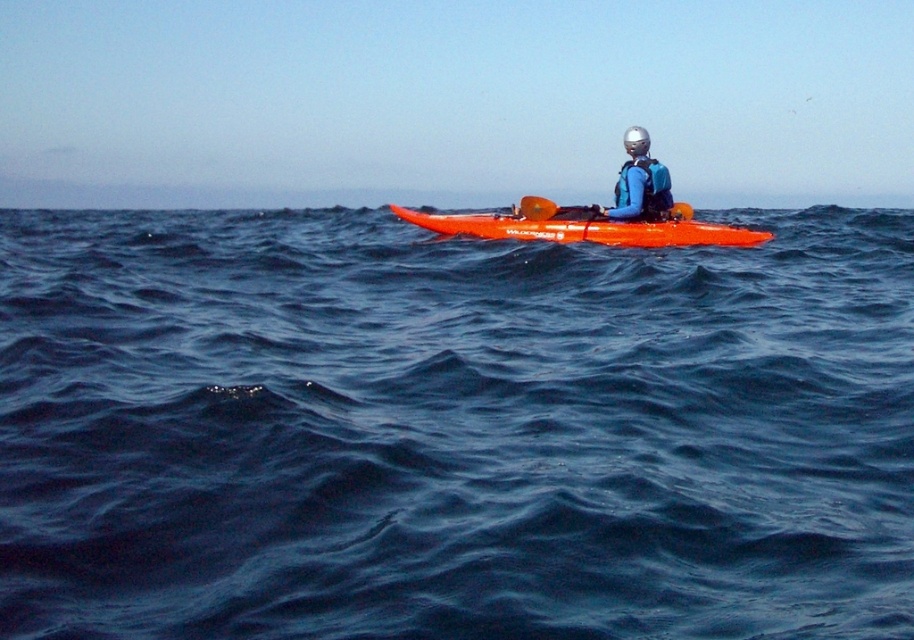
You are a photographer trying to capture a photo of the blue water at center and the orange rubber paddle at center. Which object should you focus on if you want to capture the larger one in your shot?

The blue water at center is bigger than the orange rubber paddle at center, so you should focus on the blue water at center to capture the larger one in your shot.

You are a photographer trying to capture the orange rubber paddle at center and the blue water at center in a single shot. Based on their positions, which object will appear closer to the camera in the photo?

The blue water at center appears closer to the camera because it is positioned in front of the orange rubber paddle at center.